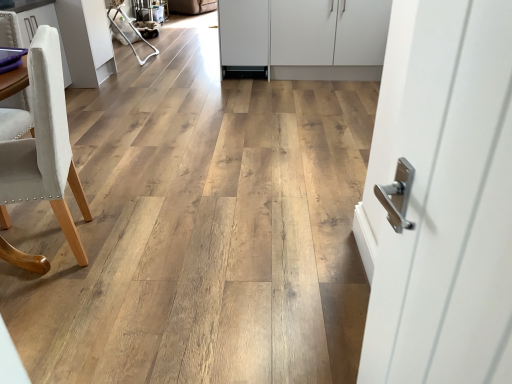
Question: Would you say white fabric armchair at upper left is outside light beige fabric chair at left?

Choices:
 (A) no
 (B) yes

Answer: (B)

Question: From the image's perspective, would you say white fabric armchair at upper left is shown under light beige fabric chair at left?

Choices:
 (A) no
 (B) yes

Answer: (A)

Question: Does white fabric armchair at upper left contain light beige fabric chair at left?

Choices:
 (A) yes
 (B) no

Answer: (B)

Question: Are white fabric armchair at upper left and light beige fabric chair at left making contact?

Choices:
 (A) no
 (B) yes

Answer: (A)

Question: Is white fabric armchair at upper left positioned with its back to light beige fabric chair at left?

Choices:
 (A) no
 (B) yes

Answer: (A)

Question: Looking at the image, does white fabric armchair at upper left seem bigger or smaller compared to white fabric chair at left, placed as the first cabinetry when sorted from left to right?

Choices:
 (A) big
 (B) small

Answer: (B)

Question: In the image, is white fabric armchair at upper left positioned in front of or behind white fabric chair at left, acting as the 2th cabinetry starting from the back?

Choices:
 (A) front
 (B) behind

Answer: (B)

Question: From a real-world perspective, is white fabric armchair at upper left physically located above or below white fabric chair at left, acting as the 2th cabinetry starting from the back?

Choices:
 (A) above
 (B) below

Answer: (B)

Question: Choose the correct answer: Is white fabric armchair at upper left inside white fabric chair at left, which is counted as the first cabinetry, starting from the front, or outside it?

Choices:
 (A) inside
 (B) outside

Answer: (B)

Question: From a real-world perspective, is white matte cabinet at center, which is the second cabinetry from front to back, physically located above or below light beige fabric chair at left?

Choices:
 (A) below
 (B) above

Answer: (A)

Question: In terms of height, does white matte cabinet at center, which is the second cabinetry from front to back, look taller or shorter compared to light beige fabric chair at left?

Choices:
 (A) short
 (B) tall

Answer: (A)

Question: Considering their positions, is white matte cabinet at center, the first cabinetry in the right-to-left sequence, located in front of or behind light beige fabric chair at left?

Choices:
 (A) behind
 (B) front

Answer: (A)

Question: In terms of size, does white matte cabinet at center, which ranks as the second cabinetry in left-to-right order, appear bigger or smaller than light beige fabric chair at left?

Choices:
 (A) big
 (B) small

Answer: (A)

Question: From the image's perspective, is light beige fabric chair at left located above or below white matte cabinet at center, the first cabinetry in the right-to-left sequence?

Choices:
 (A) below
 (B) above

Answer: (A)

Question: Based on their sizes in the image, would you say light beige fabric chair at left is bigger or smaller than white matte cabinet at center, the first cabinetry in the right-to-left sequence?

Choices:
 (A) small
 (B) big

Answer: (A)